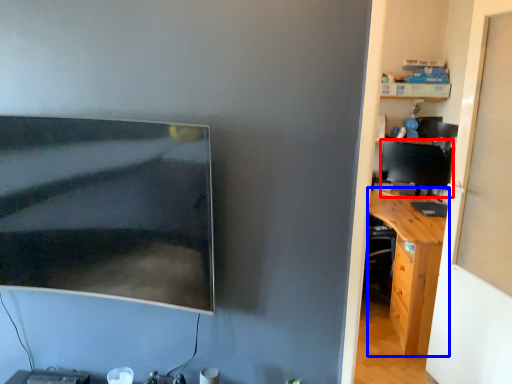
Question: Which object is closer to the camera taking this photo, computer monitor (highlighted by a red box) or desk (highlighted by a blue box)?

Choices:
 (A) computer monitor
 (B) desk

Answer: (B)